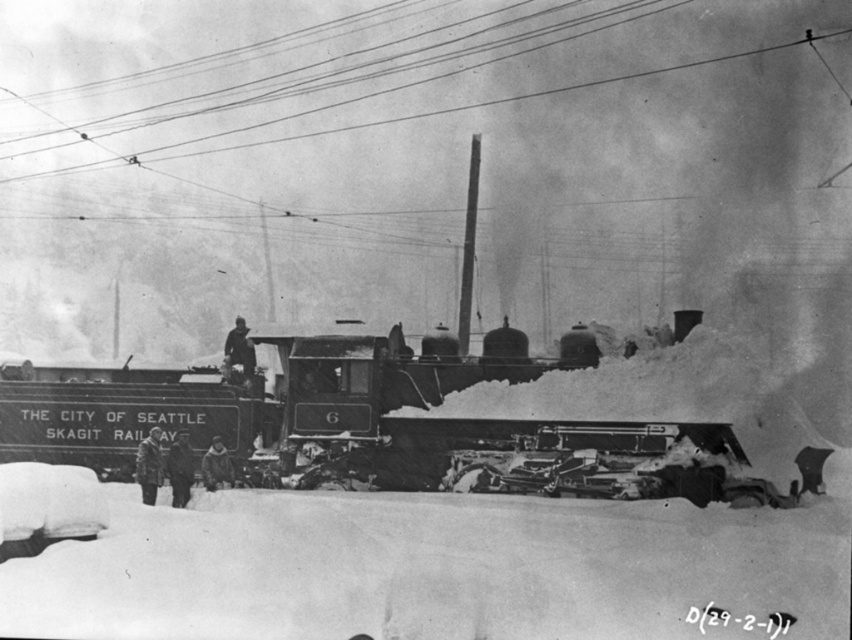
Question: Where is polished steel train at center located in relation to smooth wire at upper center in the image?

Choices:
 (A) below
 (B) above

Answer: (A)

Question: Where is polished steel train at center located in relation to smooth wire at upper center in the image?

Choices:
 (A) right
 (B) left

Answer: (B)

Question: Which of the following is the closest to the observer?

Choices:
 (A) smooth wire at upper center
 (B) polished steel train at center

Answer: (B)

Question: Can you confirm if polished steel train at center is positioned above smooth wire at upper center?

Choices:
 (A) yes
 (B) no

Answer: (B)

Question: Which point is farther to the camera?

Choices:
 (A) (689, 67)
 (B) (216, 435)

Answer: (A)

Question: Which object appears farthest from the camera in this image?

Choices:
 (A) polished steel train at center
 (B) smooth wire at upper center

Answer: (B)